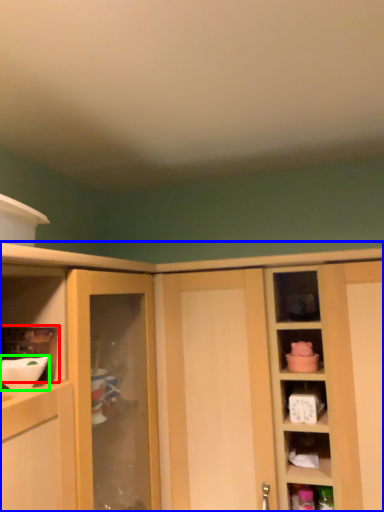
Question: Which object is the closest to the shelf (highlighted by a red box)? Choose among these: cabinetry (highlighted by a blue box) or mixing bowl (highlighted by a green box).

Choices:
 (A) cabinetry
 (B) mixing bowl

Answer: (B)